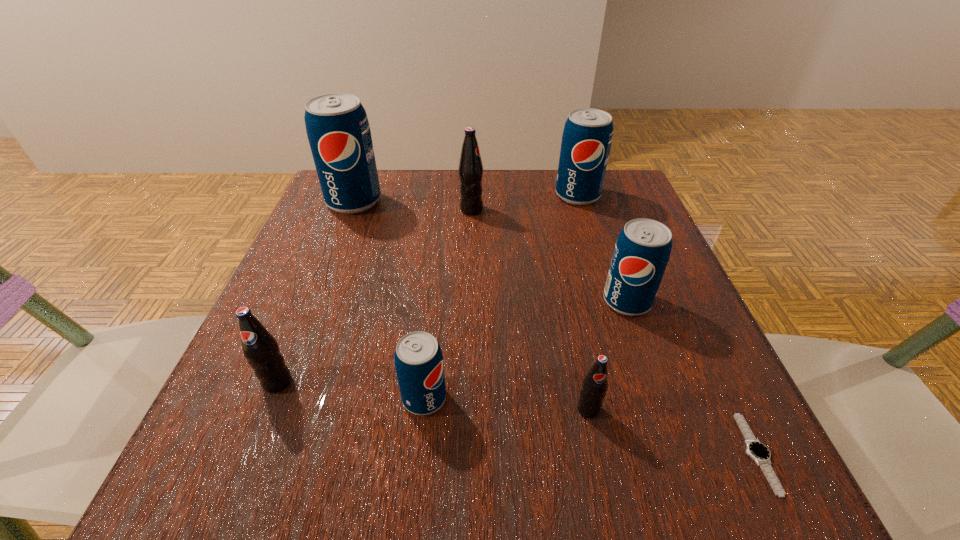
The width and height of the screenshot is (960, 540). Identify the location of the biggest blue pop. (338, 131).

This screenshot has height=540, width=960. I want to click on the leftmost blue pop, so click(x=338, y=131).

What are the coordinates of `the third smallest blue pop` in the screenshot? It's located at [587, 136].

Image resolution: width=960 pixels, height=540 pixels. Identify the location of the farthest black pop. (470, 170).

This screenshot has height=540, width=960. I want to click on the fourth pop from left to right, so click(x=470, y=170).

Image resolution: width=960 pixels, height=540 pixels. I want to click on the third biggest blue pop, so click(x=642, y=251).

The image size is (960, 540). Find the location of `the fourth farthest object`. the fourth farthest object is located at coordinates (642, 251).

Identify the location of the second smallest black pop. This screenshot has width=960, height=540. (260, 348).

You are a GUI agent. You are given a task and a screenshot of the screen. Output one action in this format:
    pyautogui.click(x=<x>, y=<y>)
    Task: Click on the second nearest black pop
    
    Given the screenshot: What is the action you would take?
    pyautogui.click(x=260, y=348)

You are a GUI agent. You are given a task and a screenshot of the screen. Output one action in this format:
    pyautogui.click(x=<x>, y=<y>)
    Task: Click on the smallest blue pop
    
    Given the screenshot: What is the action you would take?
    pyautogui.click(x=418, y=358)